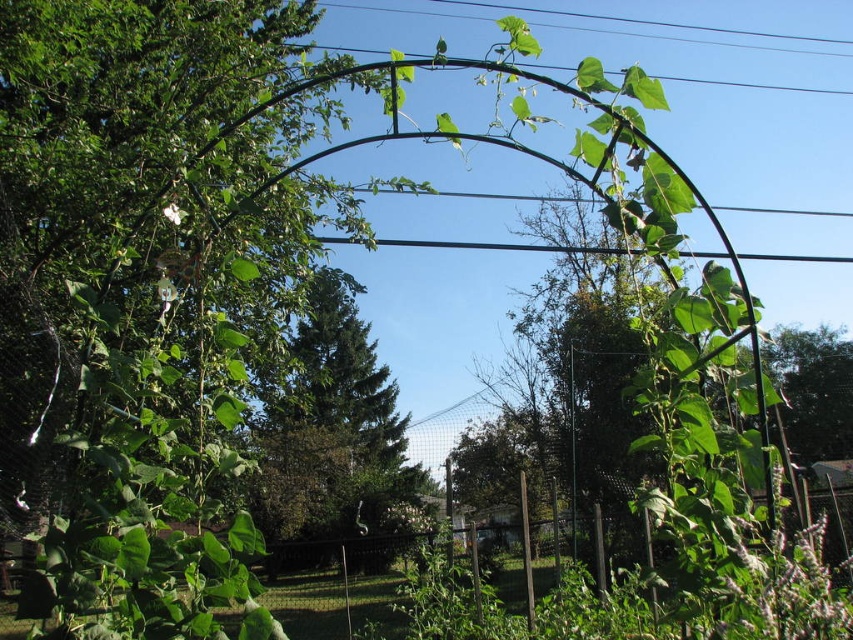
Question: Which point is closer to the camera?

Choices:
 (A) green leafy tree at center
 (B) green matte trellis at center

Answer: (B)

Question: Does green matte trellis at center have a greater width compared to green leafy tree at center?

Choices:
 (A) yes
 (B) no

Answer: (A)

Question: Is green matte trellis at center positioned in front of green leafy tree at center?

Choices:
 (A) yes
 (B) no

Answer: (A)

Question: Which object is farther from the camera taking this photo?

Choices:
 (A) green matte trellis at center
 (B) green leafy tree at center

Answer: (B)

Question: Among these points, which one is farthest from the camera?

Choices:
 (A) (289, 208)
 (B) (392, 378)

Answer: (B)

Question: Can you confirm if green matte trellis at center is positioned to the right of green leafy tree at center?

Choices:
 (A) yes
 (B) no

Answer: (B)